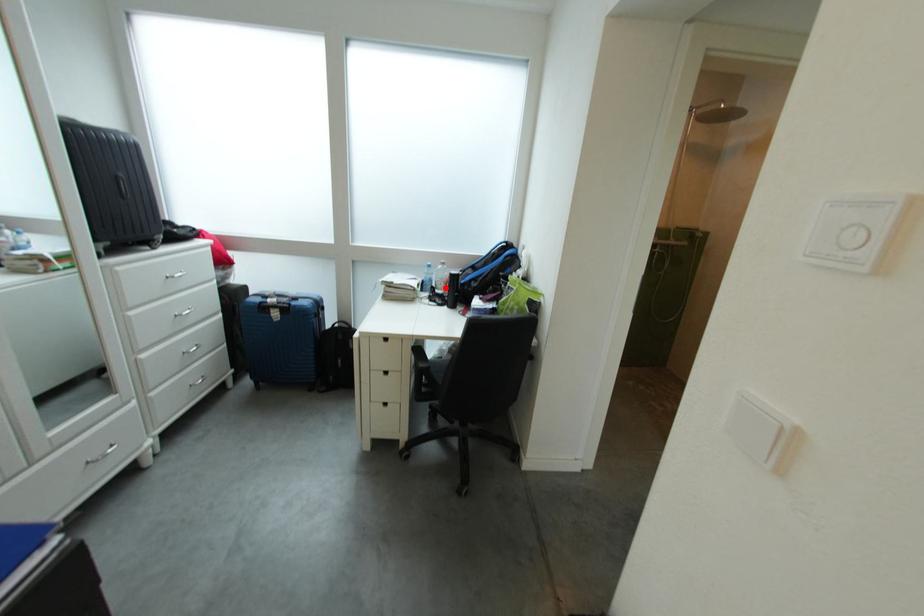
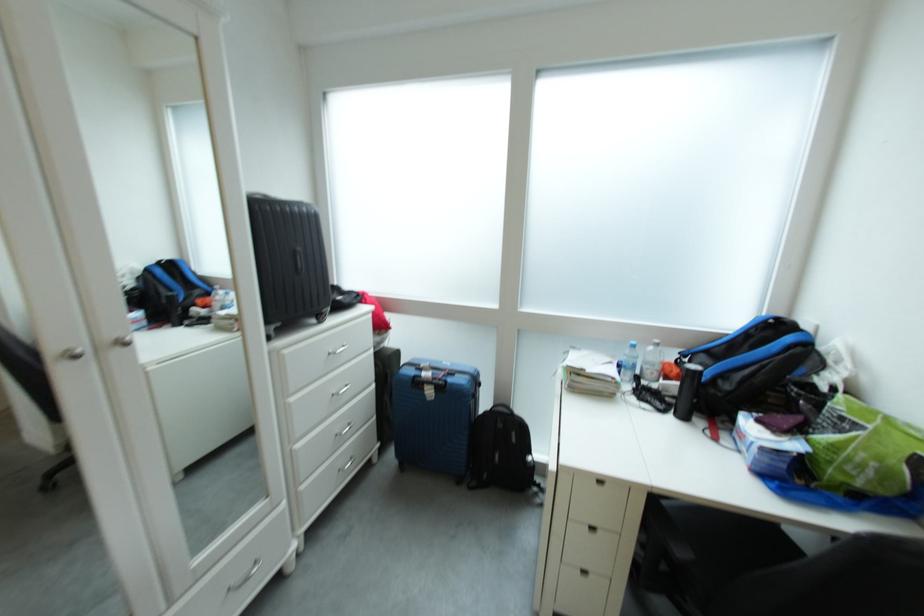
Where in the second image is the point corresponding to the highlighted location from the first image?

(650, 376)